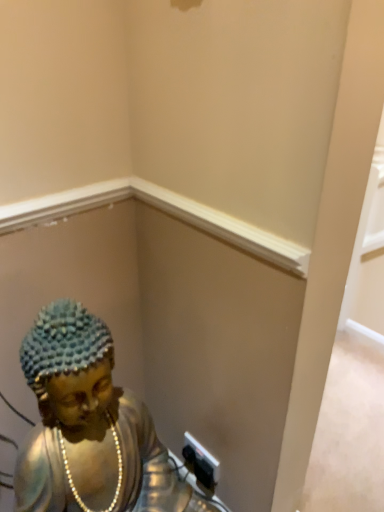
What do you see at coordinates (89, 426) in the screenshot?
I see `gold metallic statue at center` at bounding box center [89, 426].

I want to click on gold metallic statue at center, so click(89, 426).

This screenshot has height=512, width=384. What are the coordinates of `gold metallic statue at center` in the screenshot? It's located at (89, 426).